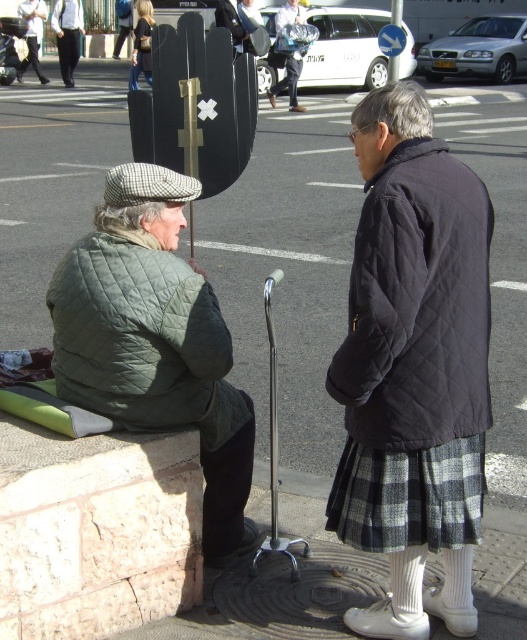
Question: Based on their relative distances, which object is nearer to the light brown leather jacket at upper left?

Choices:
 (A) black trousers at upper left
 (B) black quilted jacket at center

Answer: (A)

Question: Does black quilted jacket at center have a smaller size compared to denim jacket at upper left?

Choices:
 (A) yes
 (B) no

Answer: (A)

Question: Which of the following is the farthest from the observer?

Choices:
 (A) (35, 74)
 (B) (366, 496)
 (C) (200, 364)

Answer: (A)

Question: Can you confirm if smooth concrete pavement at center is thinner than black trousers at upper left?

Choices:
 (A) no
 (B) yes

Answer: (A)

Question: Which point is closer to the camera?

Choices:
 (A) (17, 70)
 (B) (291, 156)
 (C) (134, 35)
 (D) (370, 237)

Answer: (D)

Question: Can you confirm if black plaid skirt at lower right is bigger than denim jacket at upper left?

Choices:
 (A) no
 (B) yes

Answer: (A)